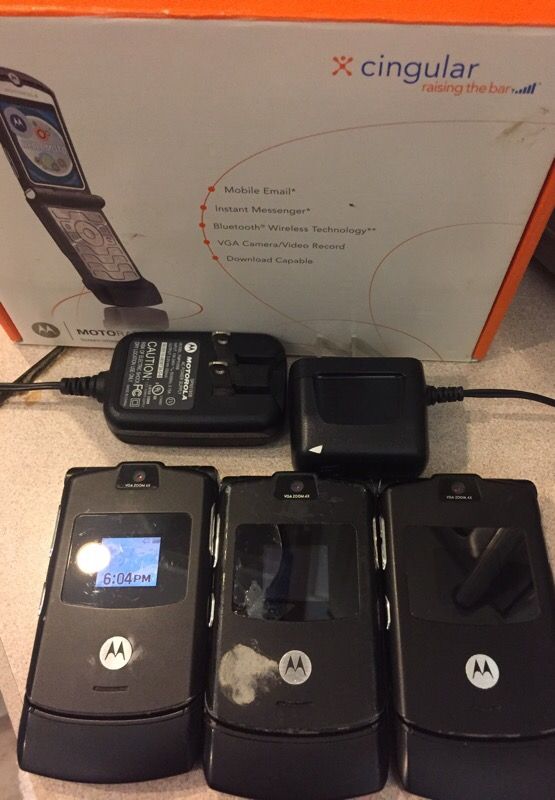
I want to click on phone, so [144, 697], [312, 690], [458, 638], [118, 298].